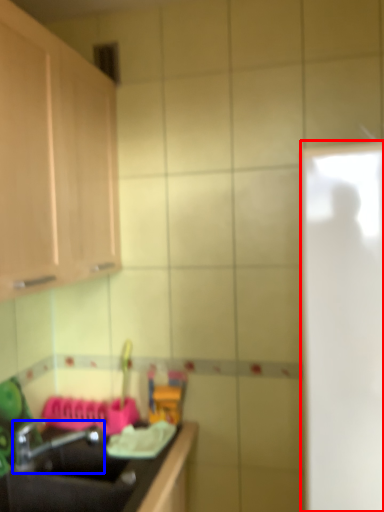
Question: Which object is further to the camera taking this photo, glass door (highlighted by a red box) or tap (highlighted by a blue box)?

Choices:
 (A) glass door
 (B) tap

Answer: (B)